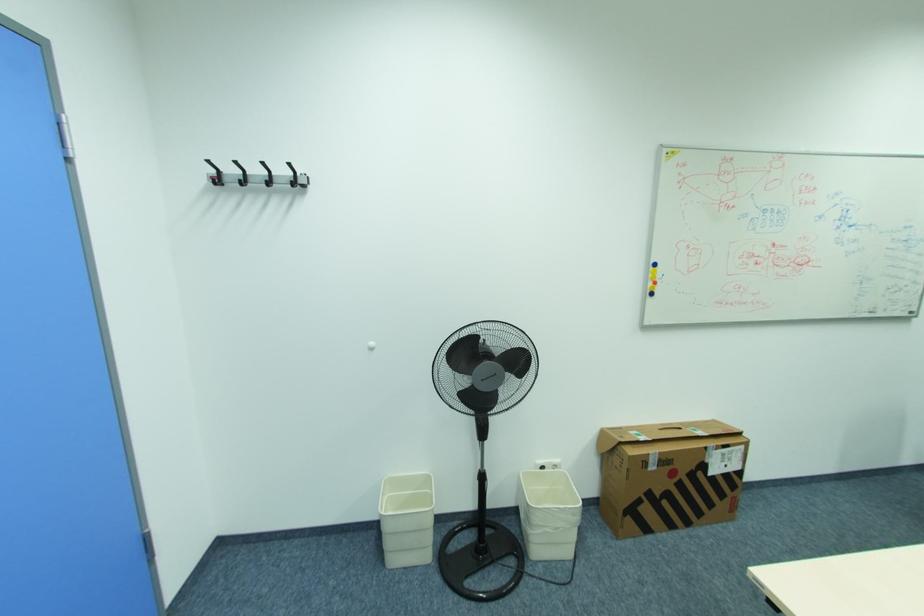
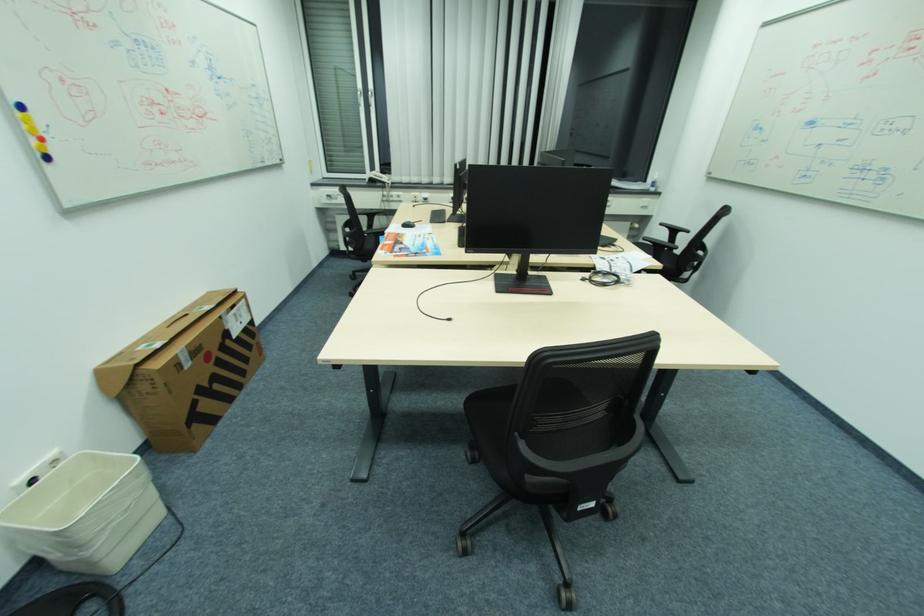
The point at (661, 284) is marked in the first image. Where is the corresponding point in the second image?

(44, 140)